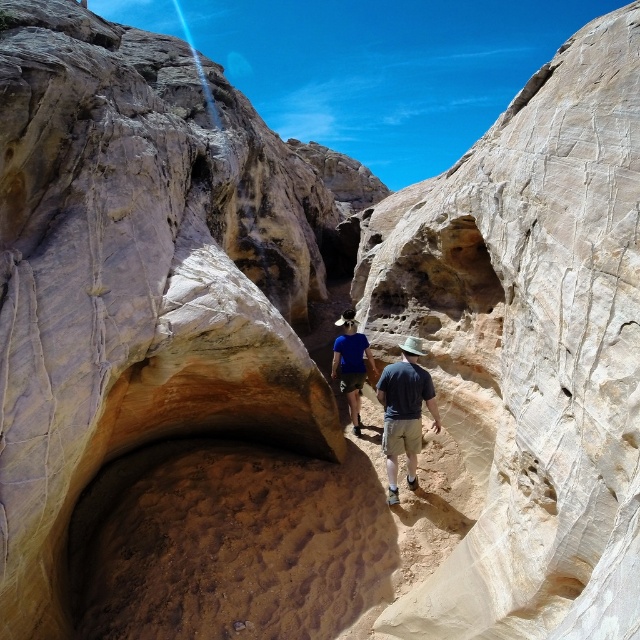
Question: Does dark blue t-shirt at center have a smaller size compared to blue matte shirt at center?

Choices:
 (A) yes
 (B) no

Answer: (A)

Question: Among these points, which one is farthest from the camera?

Choices:
 (A) (355, 346)
 (B) (424, 380)

Answer: (A)

Question: Where is dark blue t-shirt at center located in relation to blue matte shirt at center in the image?

Choices:
 (A) right
 (B) left

Answer: (A)

Question: Can you confirm if dark blue t-shirt at center is smaller than blue matte shirt at center?

Choices:
 (A) yes
 (B) no

Answer: (A)